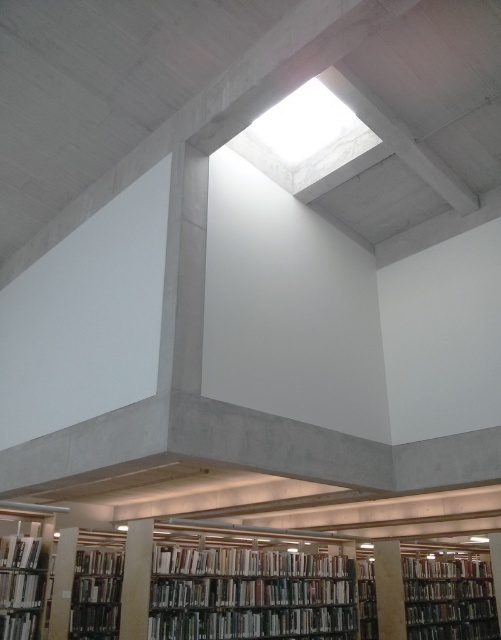
Question: Among these objects, which one is nearest to the camera?

Choices:
 (A) green matte bookcase at center
 (B) hardcover book at lower left
 (C) hardcover books at lower left
 (D) wooden bookcase at lower center

Answer: (B)

Question: Which is nearer to the wooden bookcase at lower center?

Choices:
 (A) hardcover books at lower left
 (B) hardcover book at lower left

Answer: (A)

Question: Observing the image, what is the correct spatial positioning of wooden bookcase at lower center in reference to hardcover book at lower left?

Choices:
 (A) above
 (B) below

Answer: (B)

Question: Which object appears closest to the camera in this image?

Choices:
 (A) green matte bookcase at center
 (B) wooden bookcase at lower center
 (C) hardcover book at lower left

Answer: (C)

Question: Is wooden bookcase at lower center further to the viewer compared to hardcover book at lower left?

Choices:
 (A) yes
 (B) no

Answer: (A)

Question: Is wooden bookcase at lower center to the left of green matte bookcase at center from the viewer's perspective?

Choices:
 (A) yes
 (B) no

Answer: (B)